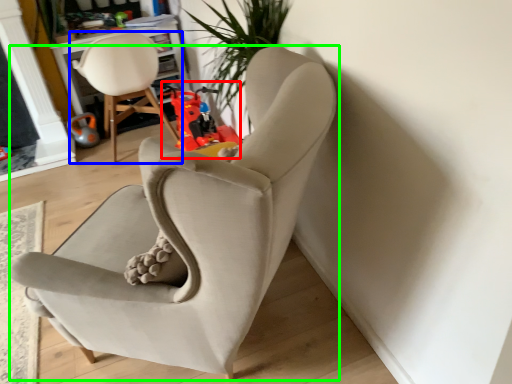
Question: Considering the real-world distances, which object is farthest from toy (highlighted by a red box)? chair (highlighted by a blue box) or chair (highlighted by a green box)?

Choices:
 (A) chair
 (B) chair

Answer: (B)